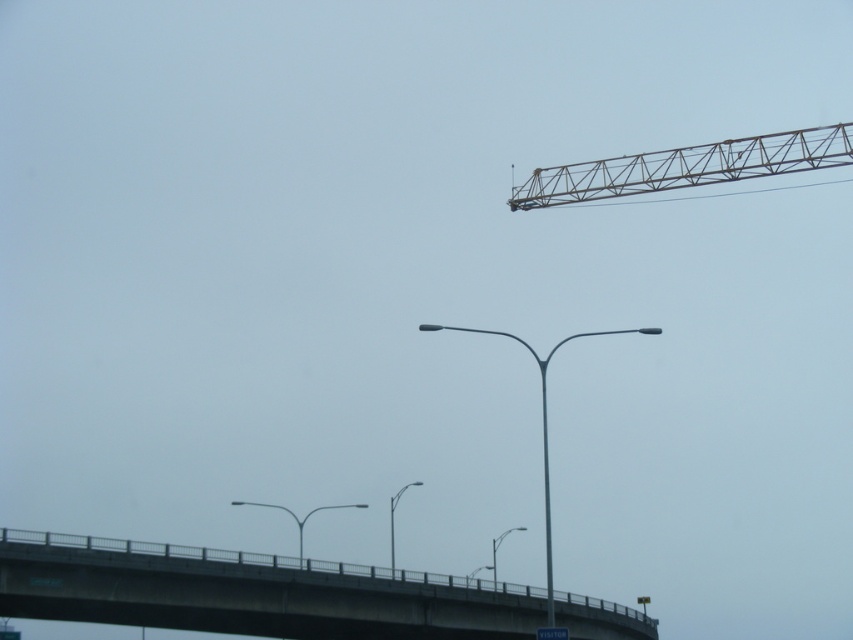
You are a construction worker standing on the concrete bridge at lower center and need to reach the metallic gray crane at upper right. Which direction should you walk to get there?

You should walk to the right because the concrete bridge at lower center is to the left of the metallic gray crane at upper right, so moving right will lead you towards it.

You are a delivery truck driver who needs to cross the concrete bridge at lower center. The truck is 3 meters wide. Can you safely pass through the bridge if the metallic gray crane at upper right is currently extending its arm over the bridge? Consider the width of the bridge and the crane.

The concrete bridge at lower center is wider than the metallic gray crane at upper right. Since the bridge is wider, the truck can safely pass under the crane as long as there is enough clearance vertically. However, the crane arm extension might affect vertical clearance, so check the height before proceeding.